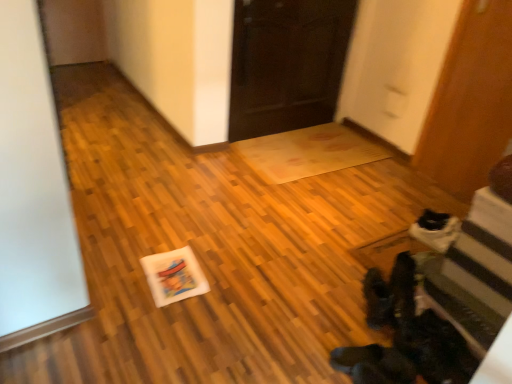
This screenshot has height=384, width=512. What do you see at coordinates (174, 276) in the screenshot?
I see `white matte postcard at center` at bounding box center [174, 276].

Where is `wooden door at right, which ranks as the second door in left-to-right order`? wooden door at right, which ranks as the second door in left-to-right order is located at coordinates (470, 101).

How distant is black suede boots at lower right from white matte postcard at center?

They are 29.94 inches apart.

From a real-world perspective, which is physically above, black suede boots at lower right or white matte postcard at center?

black suede boots at lower right is physically above.

From the picture: Is black suede boots at lower right positioned with its back to white matte postcard at center?

black suede boots at lower right does not have its back to white matte postcard at center.

Considering the sizes of objects black suede boots at lower right and white matte postcard at center in the image provided, who is wider, black suede boots at lower right or white matte postcard at center?

Wider between the two is black suede boots at lower right.

From the picture: Which object is more forward, black suede boots at lower right or wooden door at right, which appears as the 1th door when viewed from the right?

black suede boots at lower right is more forward.

Does point (377, 310) lie in front of point (437, 141)?

Yes, it is in front of point (437, 141).

Can we say black suede boots at lower right lies outside wooden door at right, which ranks as the second door in left-to-right order?

black suede boots at lower right lies outside wooden door at right, which ranks as the second door in left-to-right order,'s area.

Image resolution: width=512 pixels, height=384 pixels. I want to click on the 1st door behind the white matte postcard at center, so click(x=470, y=101).

Considering the sizes of objects wooden door at right, which appears as the 1th door when viewed from the right, and white matte postcard at center in the image provided, who is wider, wooden door at right, which appears as the 1th door when viewed from the right, or white matte postcard at center?

white matte postcard at center is wider.

Is wooden door at right, which ranks as the second door in left-to-right order, spatially inside white matte postcard at center, or outside of it?

wooden door at right, which ranks as the second door in left-to-right order, lies outside white matte postcard at center.

From the image's perspective, does wooden door at right, which appears as the 1th door when viewed from the right, appear higher than white matte postcard at center?

Yes, from the image's perspective, wooden door at right, which appears as the 1th door when viewed from the right, is over white matte postcard at center.

What's the angular difference between wooden door at right, which ranks as the second door in left-to-right order, and dark wood door at center, which appears as the 1th door when viewed from the left,'s facing directions?

The angular difference between wooden door at right, which ranks as the second door in left-to-right order, and dark wood door at center, which appears as the 1th door when viewed from the left, is 91.5 degrees.

Does wooden door at right, which appears as the 1th door when viewed from the right, touch dark wood door at center, which appears as the 1th door when viewed from the left?

No.

You are a GUI agent. You are given a task and a screenshot of the screen. Output one action in this format:
    pyautogui.click(x=<x>, y=<y>)
    Task: Click on the door lying in front of the dark wood door at center, which appears as the 1th door when viewed from the left
    
    Given the screenshot: What is the action you would take?
    pyautogui.click(x=470, y=101)

Which is closer, (445, 87) or (332, 48)?

Point (445, 87) is closer to the camera than point (332, 48).

From the image's perspective, is dark wood door at center, which appears as the 1th door when viewed from the left, above or below wooden door at right, which appears as the 1th door when viewed from the right?

From the image's perspective, dark wood door at center, which appears as the 1th door when viewed from the left, appears above wooden door at right, which appears as the 1th door when viewed from the right.

Considering the positions of objects dark wood door at center, which appears as the 1th door when viewed from the left, and wooden door at right, which appears as the 1th door when viewed from the right, in the image provided, who is more to the right, dark wood door at center, which appears as the 1th door when viewed from the left, or wooden door at right, which appears as the 1th door when viewed from the right,?

wooden door at right, which appears as the 1th door when viewed from the right.

Identify the location of door above the dark wood door at center, placed as the 2th door when sorted from right to left (from a real-world perspective). Image resolution: width=512 pixels, height=384 pixels. (470, 101).

Is dark wood door at center, which appears as the 1th door when viewed from the left, not near wooden door at right, which ranks as the second door in left-to-right order?

dark wood door at center, which appears as the 1th door when viewed from the left, is near wooden door at right, which ranks as the second door in left-to-right order, not far away.

Can you confirm if wooden door at right, which appears as the 1th door when viewed from the right, is smaller than black suede boots at lower right?

Actually, wooden door at right, which appears as the 1th door when viewed from the right, might be larger than black suede boots at lower right.

Can you confirm if wooden door at right, which ranks as the second door in left-to-right order, is thinner than black suede boots at lower right?

Yes, wooden door at right, which ranks as the second door in left-to-right order, is thinner than black suede boots at lower right.

From a real-world perspective, between wooden door at right, which ranks as the second door in left-to-right order, and black suede boots at lower right, who is vertically lower?

In real-world perspective, black suede boots at lower right is lower.

Is wooden door at right, which appears as the 1th door when viewed from the right, not close to black suede boots at lower right?

wooden door at right, which appears as the 1th door when viewed from the right, is positioned a significant distance from black suede boots at lower right.

Is dark wood door at center, placed as the 2th door when sorted from right to left, far away from black suede boots at lower right?

Indeed, dark wood door at center, placed as the 2th door when sorted from right to left, is not near black suede boots at lower right.

Is dark wood door at center, which appears as the 1th door when viewed from the left, wider or thinner than black suede boots at lower right?

Considering their sizes, dark wood door at center, which appears as the 1th door when viewed from the left, looks slimmer than black suede boots at lower right.

Can you confirm if dark wood door at center, placed as the 2th door when sorted from right to left, is taller than black suede boots at lower right?

Indeed, dark wood door at center, placed as the 2th door when sorted from right to left, has a greater height compared to black suede boots at lower right.

Which is in front, point (344, 30) or point (393, 307)?

Point (393, 307)

Find the location of a particular element. This screenshot has height=384, width=512. postcard lying on the left of black suede boots at lower right is located at coordinates (174, 276).

The height and width of the screenshot is (384, 512). Identify the location of footwear that appears in front of the wooden door at right, which appears as the 1th door when viewed from the right. (378, 300).

Looking at the image, which one is located closer to wooden door at right, which ranks as the second door in left-to-right order, dark wood door at center, which appears as the 1th door when viewed from the left, or black suede boots at lower right?

dark wood door at center, which appears as the 1th door when viewed from the left, is positioned closer to the anchor wooden door at right, which ranks as the second door in left-to-right order.

Considering their positions, is dark wood door at center, placed as the 2th door when sorted from right to left, positioned further to black suede boots at lower right than wooden door at right, which ranks as the second door in left-to-right order?

Based on the image, dark wood door at center, placed as the 2th door when sorted from right to left, appears to be further to black suede boots at lower right.

Looking at the image, which one is located further to wooden door at right, which appears as the 1th door when viewed from the right, dark wood door at center, which appears as the 1th door when viewed from the left, or white matte postcard at center?

white matte postcard at center.

From the image, which object appears to be nearer to white matte postcard at center, black suede boots at lower right or dark wood door at center, which appears as the 1th door when viewed from the left?

Among the two, black suede boots at lower right is located nearer to white matte postcard at center.

Looking at the image, which one is located closer to wooden door at right, which ranks as the second door in left-to-right order, black suede boots at lower right or white matte postcard at center?

black suede boots at lower right is closer to wooden door at right, which ranks as the second door in left-to-right order.

Estimate the real-world distances between objects in this image. Which object is further from dark wood door at center, placed as the 2th door when sorted from right to left, white matte postcard at center or wooden door at right, which ranks as the second door in left-to-right order?

Based on the image, white matte postcard at center appears to be further to dark wood door at center, placed as the 2th door when sorted from right to left.

Based on their spatial positions, is wooden door at right, which ranks as the second door in left-to-right order, or black suede boots at lower right closer to dark wood door at center, which appears as the 1th door when viewed from the left?

wooden door at right, which ranks as the second door in left-to-right order, is closer to dark wood door at center, which appears as the 1th door when viewed from the left.

Looking at the image, which one is located closer to wooden door at right, which appears as the 1th door when viewed from the right, black suede boots at lower right or dark wood door at center, placed as the 2th door when sorted from right to left?

dark wood door at center, placed as the 2th door when sorted from right to left, is positioned closer to the anchor wooden door at right, which appears as the 1th door when viewed from the right.

The width and height of the screenshot is (512, 384). I want to click on postcard between dark wood door at center, which appears as the 1th door when viewed from the left, and black suede boots at lower right vertically, so click(174, 276).

Where is `footwear between white matte postcard at center and wooden door at right, which ranks as the second door in left-to-right order, in the horizontal direction`? This screenshot has height=384, width=512. footwear between white matte postcard at center and wooden door at right, which ranks as the second door in left-to-right order, in the horizontal direction is located at coordinates (378, 300).

Locate an element on the screen. The height and width of the screenshot is (384, 512). door between white matte postcard at center and wooden door at right, which appears as the 1th door when viewed from the right, in the horizontal direction is located at coordinates (287, 64).

Locate an element on the screen. The image size is (512, 384). door between dark wood door at center, placed as the 2th door when sorted from right to left, and black suede boots at lower right from top to bottom is located at coordinates (470, 101).